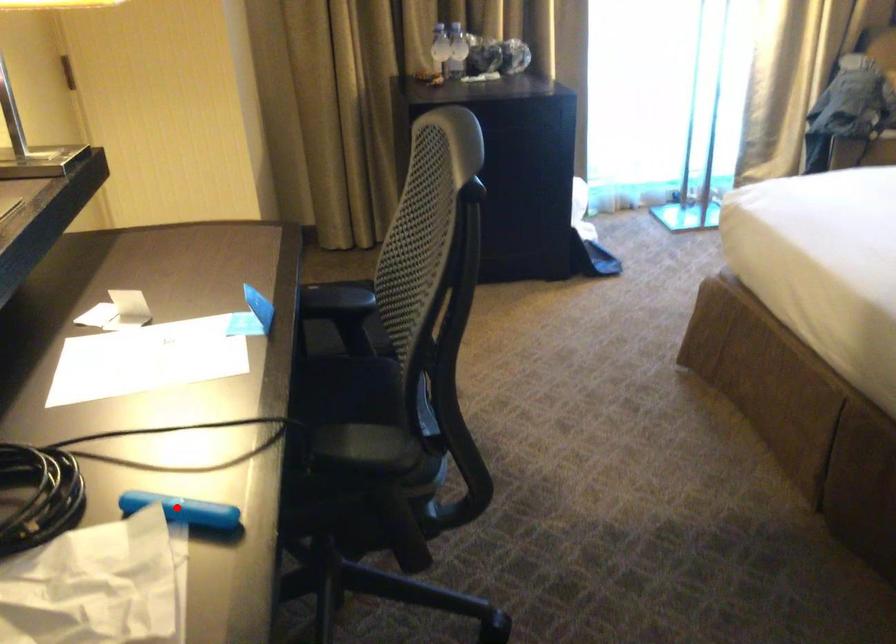
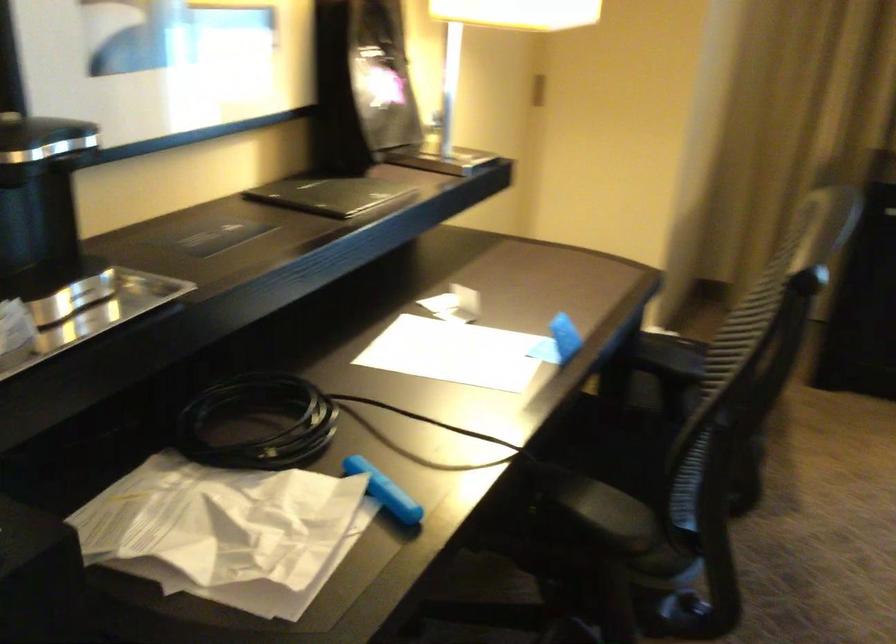
In the second image, find the point that corresponds to the highlighted location in the first image.

(384, 491)